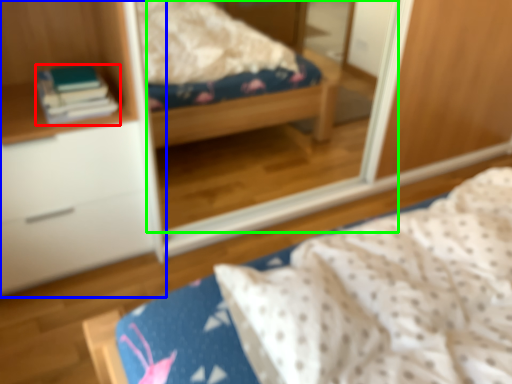
Question: Considering the real-world distances, which object is farthest from book (highlighted by a red box)? cabinetry (highlighted by a blue box) or mirror (highlighted by a green box)?

Choices:
 (A) cabinetry
 (B) mirror

Answer: (B)